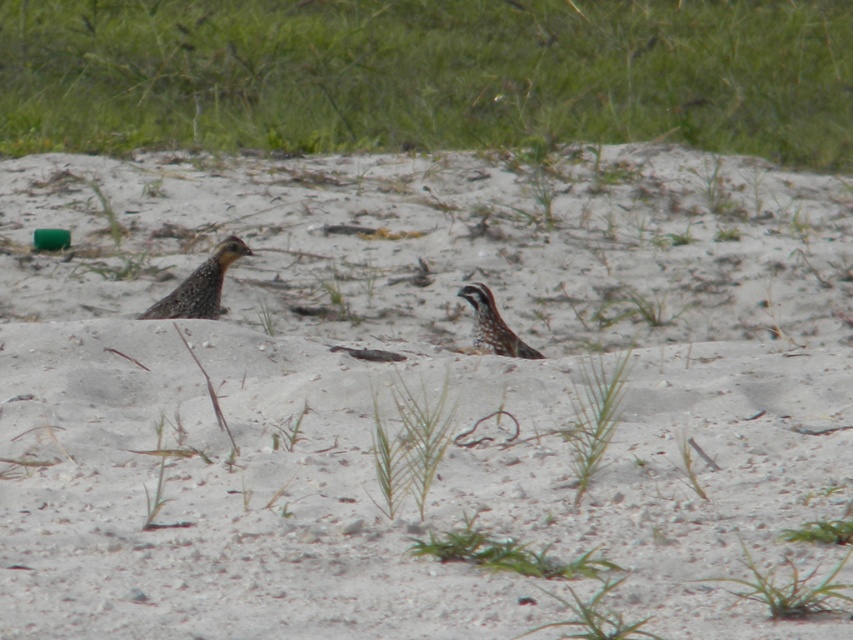
Question: Which point is farther to the camera?

Choices:
 (A) (219, 285)
 (B) (512, 342)

Answer: (A)

Question: Does speckled brown bird at left appear over speckled brown bird at center?

Choices:
 (A) no
 (B) yes

Answer: (B)

Question: Where is speckled brown bird at left located in relation to speckled brown bird at center in the image?

Choices:
 (A) below
 (B) above

Answer: (B)

Question: Which object is farther from the camera taking this photo?

Choices:
 (A) speckled brown bird at center
 (B) speckled brown bird at left

Answer: (B)

Question: Is the position of speckled brown bird at left more distant than that of speckled brown bird at center?

Choices:
 (A) no
 (B) yes

Answer: (B)